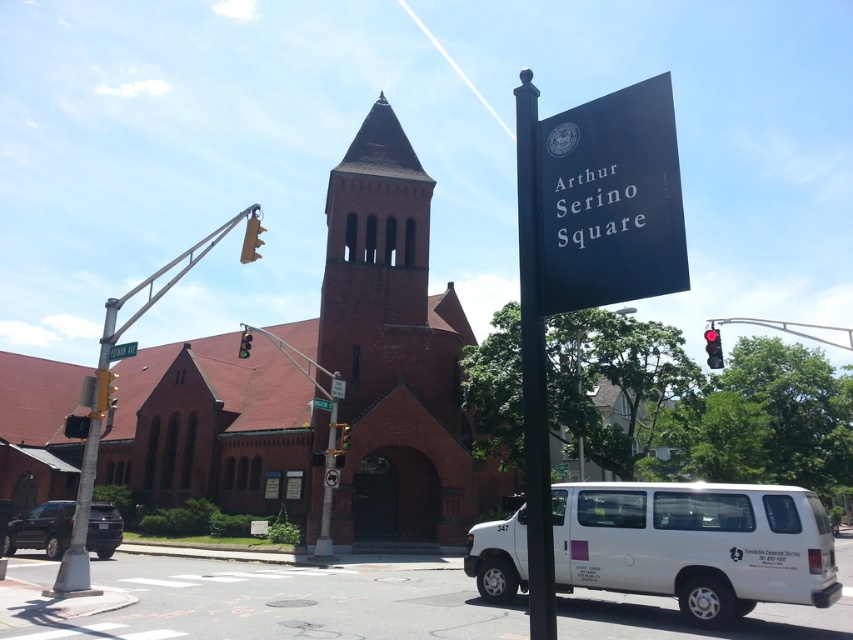
Is red glass traffic light at upper center above green glass traffic light at upper center?

Correct, red glass traffic light at upper center is located above green glass traffic light at upper center.

The image size is (853, 640). What do you see at coordinates (244, 342) in the screenshot?
I see `red glass traffic light at upper center` at bounding box center [244, 342].

Locate an element on the screen. red glass traffic light at upper center is located at coordinates (244, 342).

From the picture: Does metallic gray traffic light pole at left have a greater width compared to green metallic street sign at center?

Indeed, metallic gray traffic light pole at left has a greater width compared to green metallic street sign at center.

You are a GUI agent. You are given a task and a screenshot of the screen. Output one action in this format:
    pyautogui.click(x=<x>, y=<y>)
    Task: Click on the metallic gray traffic light pole at left
    The height and width of the screenshot is (640, 853).
    Given the screenshot: What is the action you would take?
    pyautogui.click(x=80, y=520)

Who is positioned more to the left, yellow plastic traffic light at upper center or red glass traffic light at upper center?

From the viewer's perspective, yellow plastic traffic light at upper center appears more on the left side.

Find the location of a particular element. The image size is (853, 640). yellow plastic traffic light at upper center is located at coordinates (76, 426).